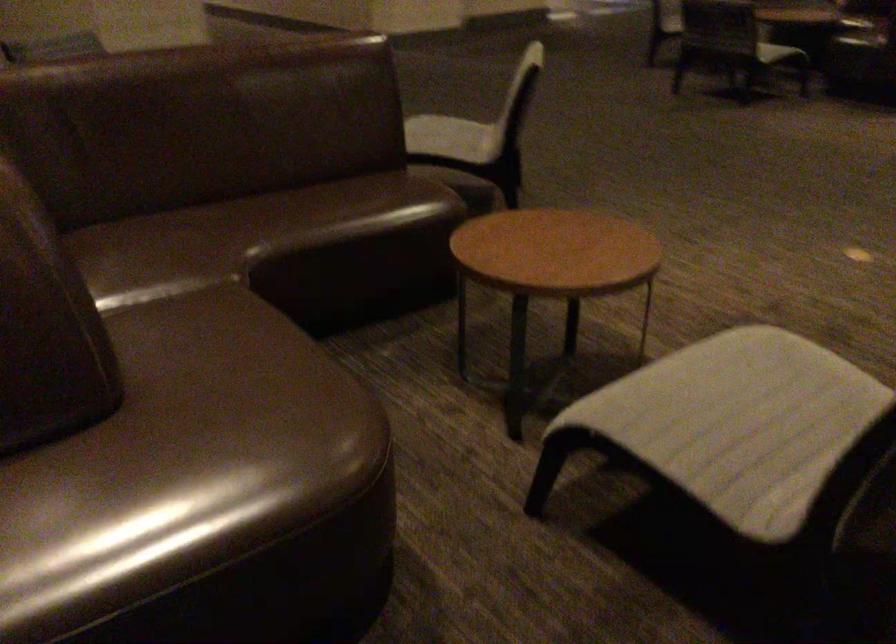
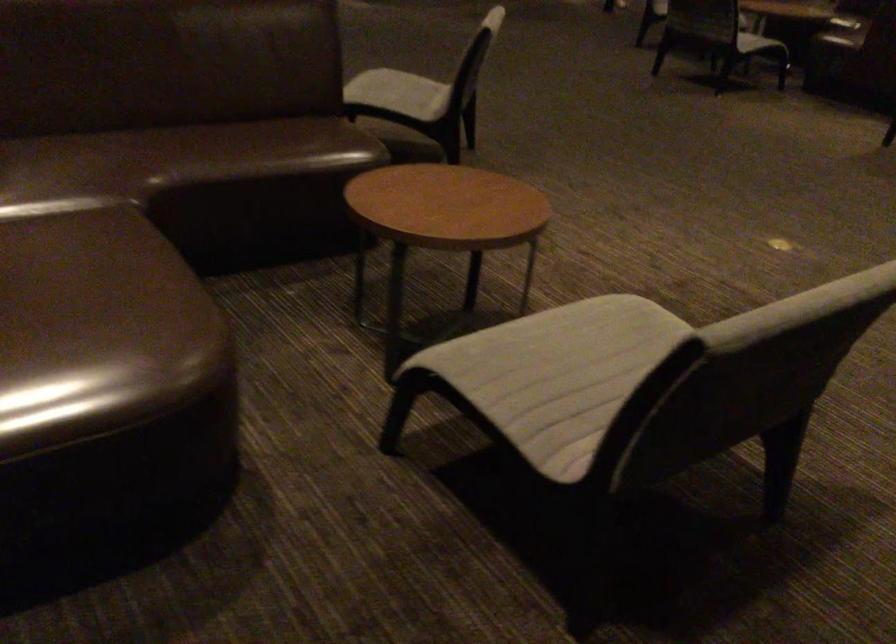
The point at (x=721, y=419) is marked in the first image. Where is the corresponding point in the second image?

(557, 374)